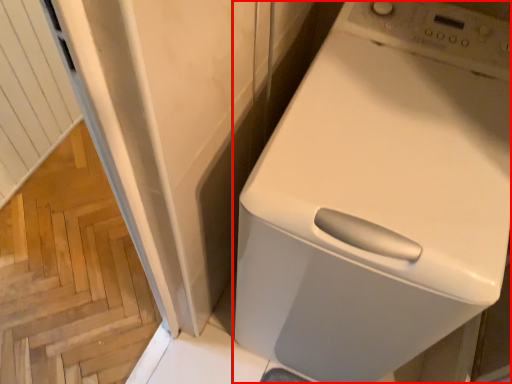
Question: In this image, where is home appliance (annotated by the red box) located relative to stairwell?

Choices:
 (A) left
 (B) right

Answer: (B)